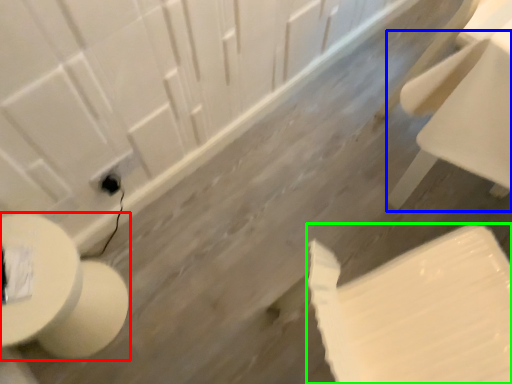
Question: Which object is positioned farthest from toilet (highlighted by a red box)? Select from chair (highlighted by a blue box) and toilet paper (highlighted by a green box).

Choices:
 (A) chair
 (B) toilet paper

Answer: (A)